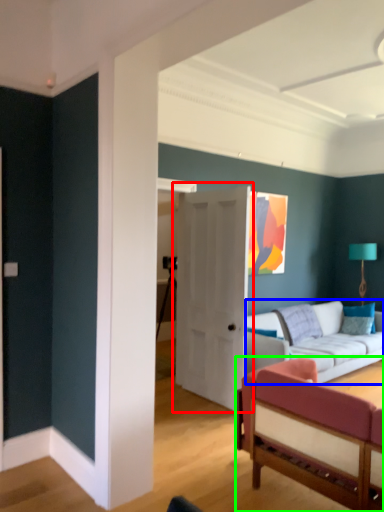
Question: Estimate the real-world distances between objects in this image. Which object is farther from door (highlighted by a red box), studio couch (highlighted by a blue box) or studio couch (highlighted by a green box)?

Choices:
 (A) studio couch
 (B) studio couch

Answer: (B)